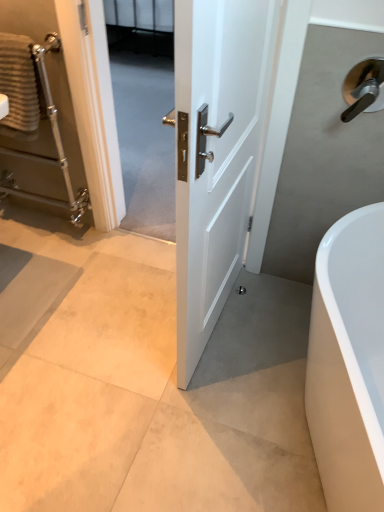
Question: Does textured beige towel at left come in front of white glossy door at center?

Choices:
 (A) yes
 (B) no

Answer: (B)

Question: Considering the relative positions of textured beige towel at left and white glossy door at center in the image provided, is textured beige towel at left behind white glossy door at center?

Choices:
 (A) yes
 (B) no

Answer: (A)

Question: From a real-world perspective, is textured beige towel at left over white glossy door at center?

Choices:
 (A) yes
 (B) no

Answer: (A)

Question: Is textured beige towel at left positioned with its back to white glossy door at center?

Choices:
 (A) yes
 (B) no

Answer: (B)

Question: Is textured beige towel at left oriented towards white glossy door at center?

Choices:
 (A) yes
 (B) no

Answer: (B)

Question: Considering the positions of point click(x=377, y=59) and point click(x=1, y=38), is point click(x=377, y=59) closer or farther from the camera than point click(x=1, y=38)?

Choices:
 (A) farther
 (B) closer

Answer: (B)

Question: Looking at the image, does polished silver door handle at upper right seem bigger or smaller compared to textured beige towel at left?

Choices:
 (A) big
 (B) small

Answer: (B)

Question: From a real-world perspective, is polished silver door handle at upper right positioned above or below textured beige towel at left?

Choices:
 (A) above
 (B) below

Answer: (A)

Question: From the image's perspective, is polished silver door handle at upper right located above or below textured beige towel at left?

Choices:
 (A) above
 (B) below

Answer: (B)

Question: Considering the positions of white glossy bathtub at lower right and textured beige towel at left in the image, is white glossy bathtub at lower right bigger or smaller than textured beige towel at left?

Choices:
 (A) big
 (B) small

Answer: (A)

Question: Would you say white glossy bathtub at lower right is to the left or to the right of textured beige towel at left in the picture?

Choices:
 (A) right
 (B) left

Answer: (A)

Question: Is white glossy bathtub at lower right spatially inside textured beige towel at left, or outside of it?

Choices:
 (A) inside
 (B) outside

Answer: (B)

Question: Is white glossy bathtub at lower right wider or thinner than textured beige towel at left?

Choices:
 (A) wide
 (B) thin

Answer: (A)

Question: Considering the positions of polished silver door handle at upper right and polished chrome towel rack at left in the image, is polished silver door handle at upper right taller or shorter than polished chrome towel rack at left?

Choices:
 (A) short
 (B) tall

Answer: (A)

Question: Is polished silver door handle at upper right inside or outside of polished chrome towel rack at left?

Choices:
 (A) inside
 (B) outside

Answer: (B)